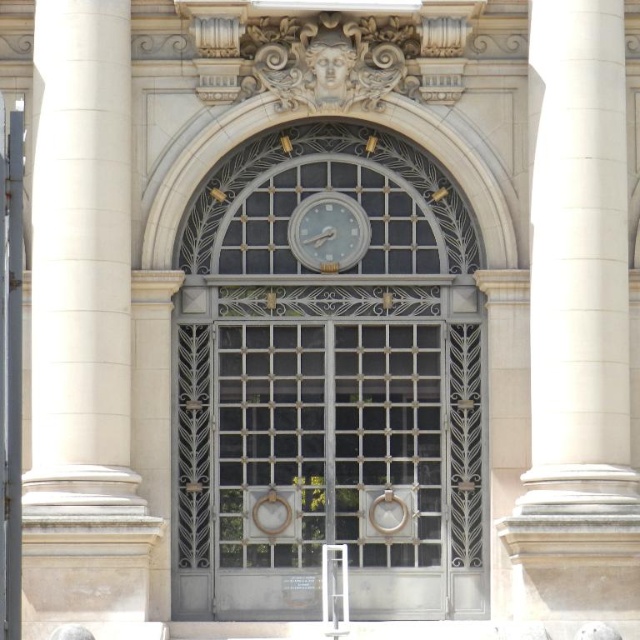
Between metallic gray clock at center and white glossy clock at upper center, which one is positioned higher?

Positioned higher is white glossy clock at upper center.

Does metallic gray clock at center have a larger size compared to white glossy clock at upper center?

Indeed, metallic gray clock at center has a larger size compared to white glossy clock at upper center.

Describe the element at coordinates (326, 385) in the screenshot. I see `metallic gray clock at center` at that location.

Where is `metallic gray clock at center`? The image size is (640, 640). metallic gray clock at center is located at coordinates (326, 385).

Is white marble column at left taller than white marble pillar at right?

Yes, white marble column at left is taller than white marble pillar at right.

Who is higher up, white marble column at left or white marble pillar at right?

white marble pillar at right

Who is more forward, (138, 500) or (620, 298)?

Point (138, 500) is in front.

I want to click on white marble column at left, so click(81, 262).

Which is above, metallic gray clock at center or white marble column at left?

white marble column at left

Does metallic gray clock at center appear under white marble column at left?

Yes, metallic gray clock at center is below white marble column at left.

Between point (465, 460) and point (83, 449), which one is positioned in front?

Point (83, 449) is in front.

The height and width of the screenshot is (640, 640). In order to click on metallic gray clock at center in this screenshot , I will do `click(326, 385)`.